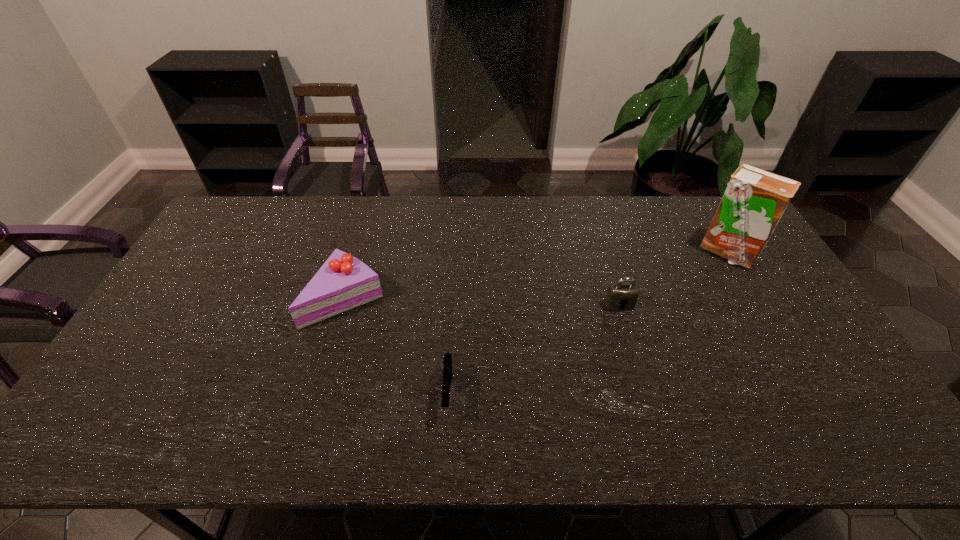
This screenshot has width=960, height=540. What are the coordinates of `object located in the near edge section of the desktop` in the screenshot? It's located at (447, 367).

The image size is (960, 540). What are the coordinates of `object at the right edge` in the screenshot? It's located at (754, 201).

Identify the location of object that is positioned at the far right corner. This screenshot has height=540, width=960. (754, 201).

Find the location of a particular element. This screenshot has width=960, height=540. vacant area at the far edge of the desktop is located at coordinates (376, 230).

The width and height of the screenshot is (960, 540). In order to click on blank space at the near edge in this screenshot , I will do `click(303, 441)`.

In the image, there is a desktop. Identify the location of free space at the right edge. (865, 401).

In the image, there is a desktop. Where is `vacant region at the far right corner`? Image resolution: width=960 pixels, height=540 pixels. vacant region at the far right corner is located at coordinates (719, 199).

Where is `vacant space in between the third object from left to right and the cake`? The height and width of the screenshot is (540, 960). vacant space in between the third object from left to right and the cake is located at coordinates (483, 302).

At what (x,y) coordinates should I click in order to perform the action: click on free space that is in between the cake and the second object from left to right. Please return your answer as a coordinate pair (x, y). This screenshot has height=540, width=960. Looking at the image, I should click on (397, 345).

Find the location of `empty location between the padlock and the cake`. empty location between the padlock and the cake is located at coordinates (483, 302).